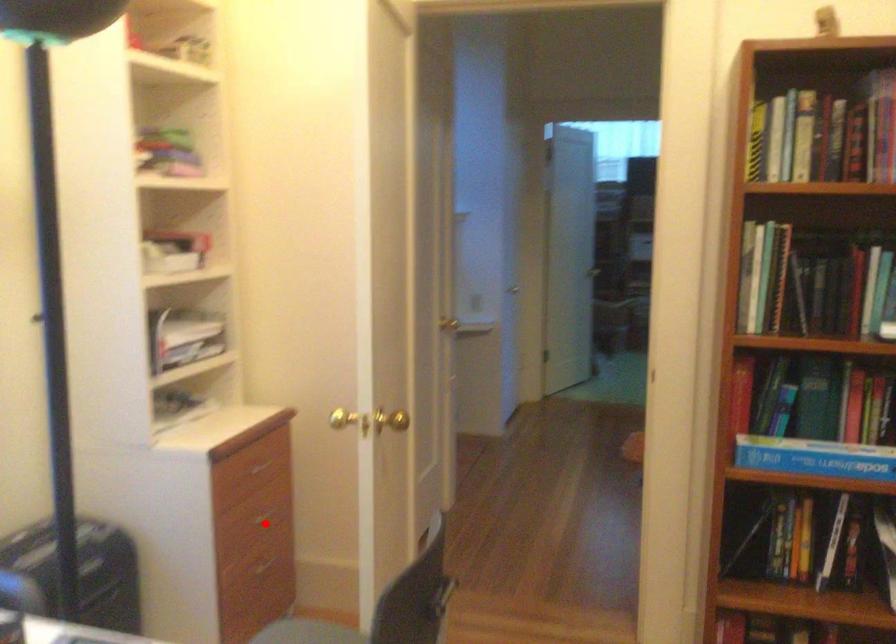
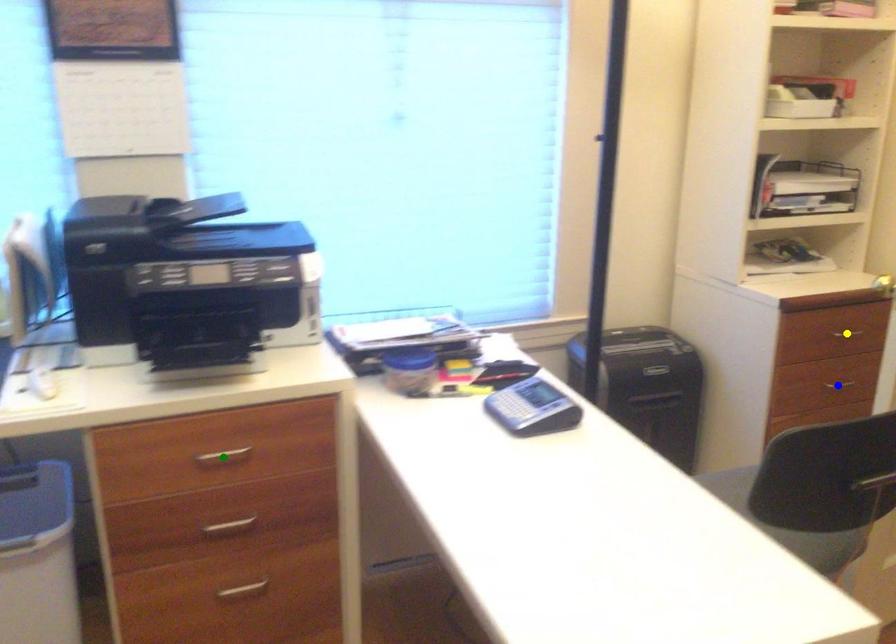
Question: I am providing you with two images of the same scene from different viewpoints. A red point is marked on the first image. You are given multiple points on the second image. Which point in image 2 represents the same 3d spot as the red point in image 1?

Choices:
 (A) green point
 (B) yellow point
 (C) blue point

Answer: (C)